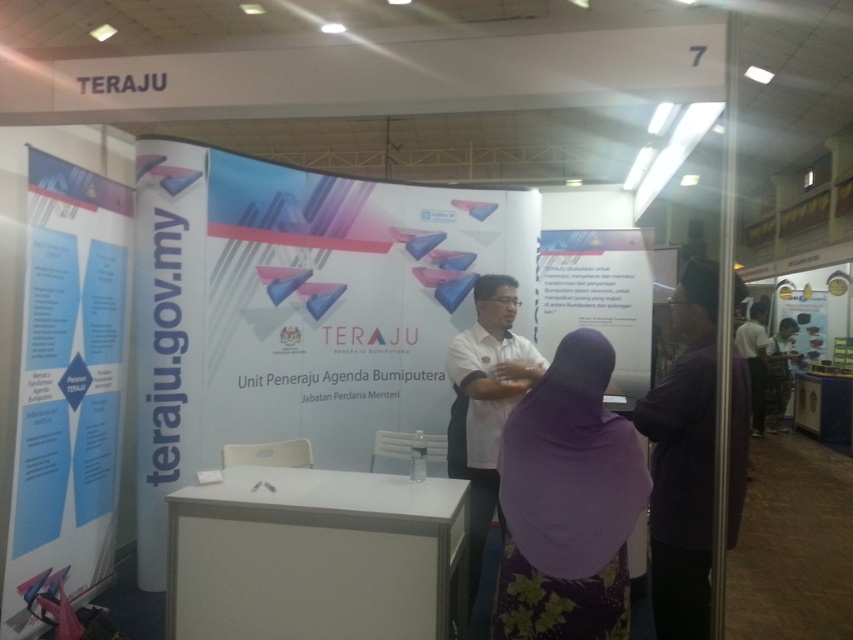
Question: Does white paper at center appear on the right side of white glossy poster at upper right?

Choices:
 (A) yes
 (B) no

Answer: (B)

Question: Is white matte poster at center thinner than white glossy poster at upper right?

Choices:
 (A) no
 (B) yes

Answer: (A)

Question: Which is farther from the white matte poster at center?

Choices:
 (A) white matte desk at center
 (B) white glossy poster at upper right
 (C) white glossy shirt at right
 (D) white paper at center

Answer: (B)

Question: Considering the real-world distances, which object is closest to the white glossy shirt at right?

Choices:
 (A) purple fabric headscarf at center
 (B) white paper at center
 (C) white paper at left
 (D) white matte desk at center

Answer: (B)

Question: Which object is positioned closest to the white paper at left?

Choices:
 (A) white paper at center
 (B) white matte poster at center

Answer: (B)

Question: Does white paper at left have a greater width compared to white shirt at center?

Choices:
 (A) no
 (B) yes

Answer: (A)